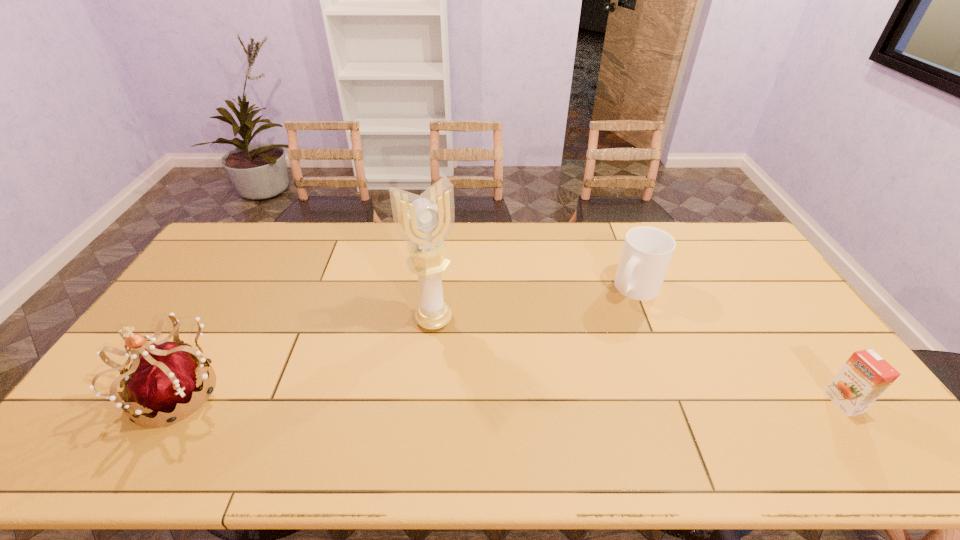
Locate an element on the screen. free region located on the handle side of the third object from left to right is located at coordinates (600, 347).

Where is `vacant space positioned on the handle side of the third object from left to right`? This screenshot has height=540, width=960. vacant space positioned on the handle side of the third object from left to right is located at coordinates (608, 334).

Locate an element on the screen. The width and height of the screenshot is (960, 540). vacant space located 0.140m on the front-facing side of the award is located at coordinates (461, 368).

Locate an element on the screen. The image size is (960, 540). blank area located on the front-facing side of the award is located at coordinates (457, 360).

At what (x,y) coordinates should I click in order to perform the action: click on vacant region located on the front-facing side of the award. Please return your answer as a coordinate pair (x, y). This screenshot has width=960, height=540. Looking at the image, I should click on (461, 368).

Locate an element on the screen. tiara that is positioned at the near edge is located at coordinates (164, 377).

Where is `orange juice at the near edge`? orange juice at the near edge is located at coordinates (866, 375).

Where is `object that is at the left edge`? object that is at the left edge is located at coordinates (164, 377).

In order to click on object that is at the right edge in this screenshot , I will do `click(866, 375)`.

Identify the location of object at the near left corner. The width and height of the screenshot is (960, 540). (164, 377).